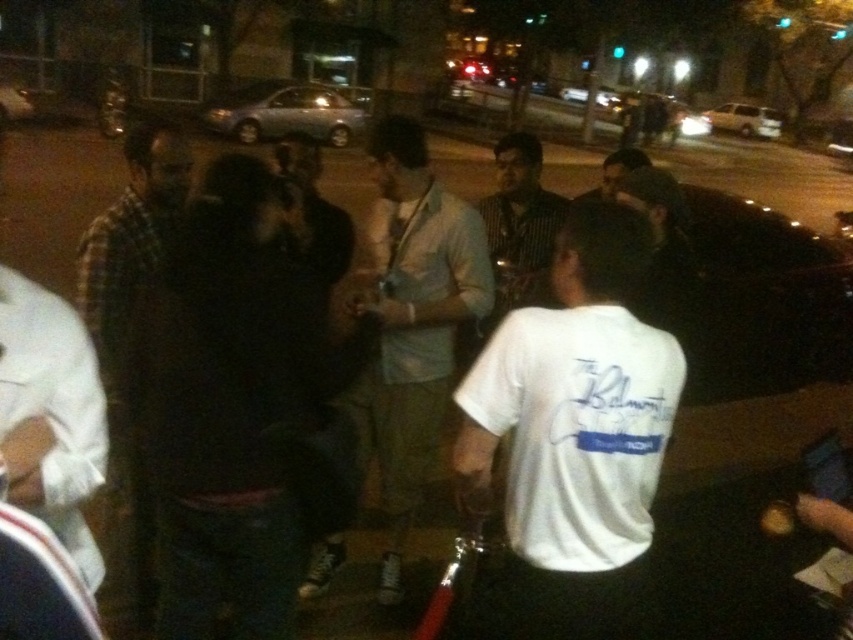
You are navigating through a dimly lit nighttime scene where two points are marked. The first point is at coordinate (393, 124) and the second at (125, 461). Based on the scene description, which point is closer to the camera?

Point (125, 461) is closer to the camera because the description states that point (393, 124) is behind point (125, 461).

You are standing at the camera position and want to reach a point that is 1.80 meters away from you. Is the point at coordinates point (462, 424) within your reach if you can extend your arm 1.80 meters?

The point at point (462, 424) is exactly 1.80 meters away from the camera. Since you can extend your arm 1.80 meters, you can just barely reach it.